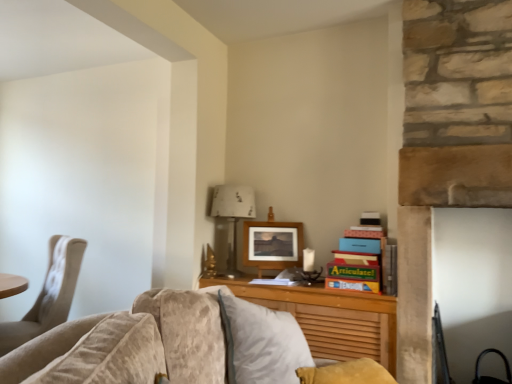
Question: Is point (51, 322) positioned closer to the camera than point (278, 231)?

Choices:
 (A) farther
 (B) closer

Answer: (B)

Question: Based on their positions, is beige fabric chair at left located to the left or right of wooden picture frame at center?

Choices:
 (A) right
 (B) left

Answer: (B)

Question: Which is farther from the wooden picture frame at center?

Choices:
 (A) wooden at center
 (B) beige fabric chair at left
 (C) wooden desk at center
 (D) metallic silver lamp at center

Answer: (B)

Question: Which object is the farthest from the wooden desk at center?

Choices:
 (A) beige fabric chair at left
 (B) wooden at center
 (C) wooden picture frame at center
 (D) metallic silver lamp at center

Answer: (A)